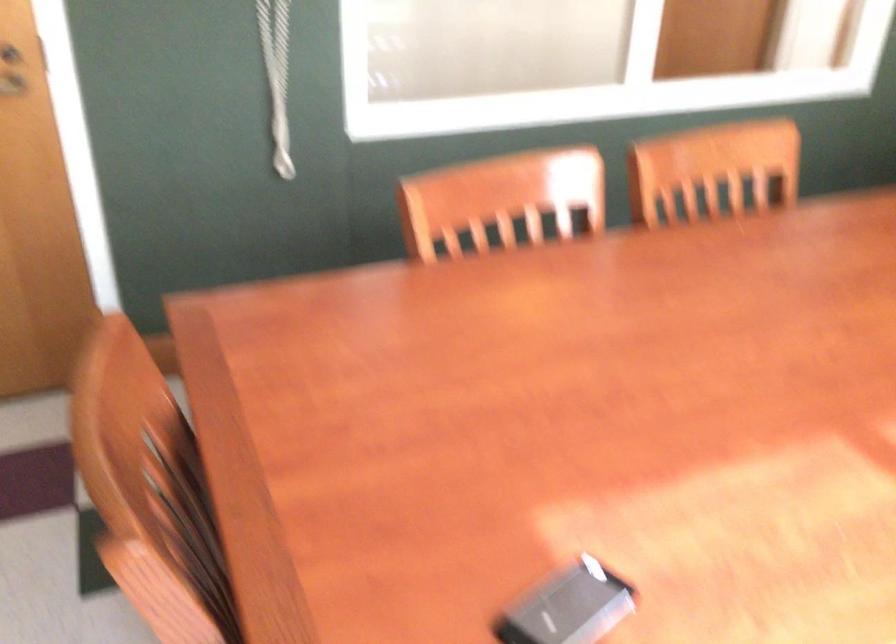
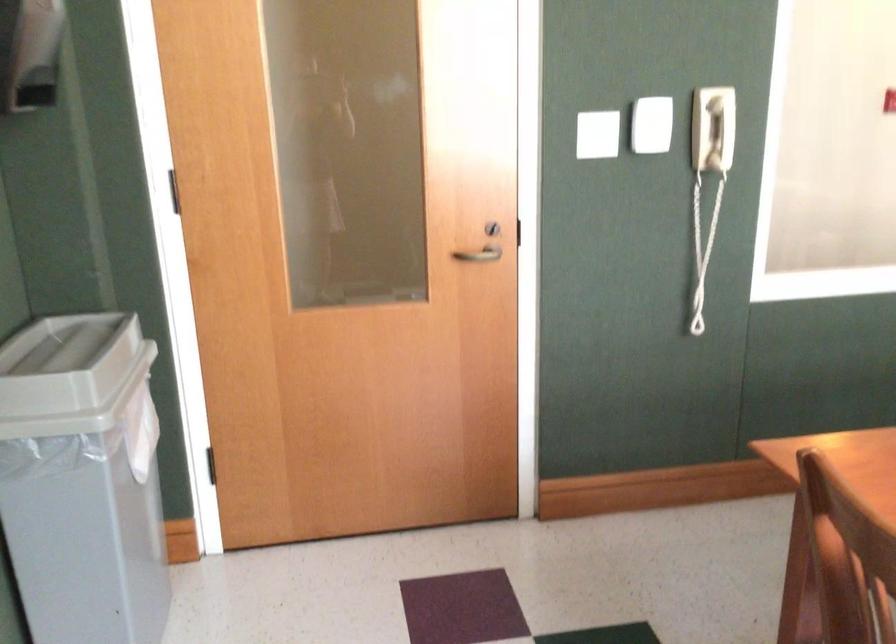
Question: The camera is either moving clockwise (left) or counter-clockwise (right) around the object. The first image is from the beginning of the video and the second image is from the end. Is the camera moving left or right when shooting the video?

Choices:
 (A) Left
 (B) Right

Answer: (B)